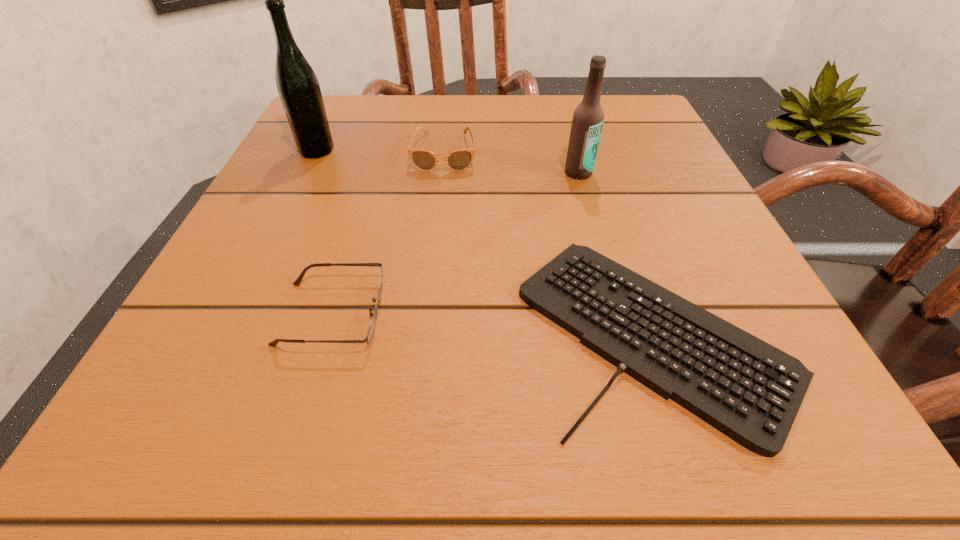
This screenshot has width=960, height=540. I want to click on the tallest object, so click(298, 87).

Identify the location of the leftmost object. (298, 87).

The height and width of the screenshot is (540, 960). Identify the location of the shorter beer bottle. click(588, 117).

Locate an element on the screen. The width and height of the screenshot is (960, 540). the right beer bottle is located at coordinates (588, 117).

Where is `sunglasses`? Image resolution: width=960 pixels, height=540 pixels. sunglasses is located at coordinates (459, 160).

This screenshot has height=540, width=960. Identify the location of the fourth tallest object. (297, 282).

This screenshot has height=540, width=960. Find the location of `computer keyboard`. computer keyboard is located at coordinates (749, 390).

Where is `vacant space located on the back of the farther beer bottle`? The image size is (960, 540). vacant space located on the back of the farther beer bottle is located at coordinates (339, 106).

You are a GUI agent. You are given a task and a screenshot of the screen. Output one action in this format:
    pyautogui.click(x=<x>, y=<y>)
    Task: Click on the free space located 0.240m on the side of the fourth shortest object with the label
    Image resolution: width=960 pixels, height=540 pixels.
    Given the screenshot: What is the action you would take?
    point(608,278)

The width and height of the screenshot is (960, 540). I want to click on vacant space located 0.240m on the front-facing side of the third tallest object, so click(x=432, y=266).